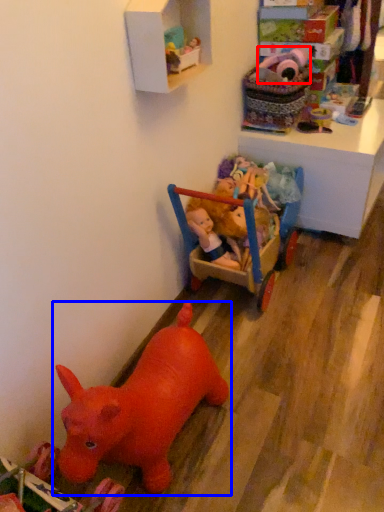
Question: Which object appears farthest to the camera in this image, toy (highlighted by a red box) or toy (highlighted by a blue box)?

Choices:
 (A) toy
 (B) toy

Answer: (A)